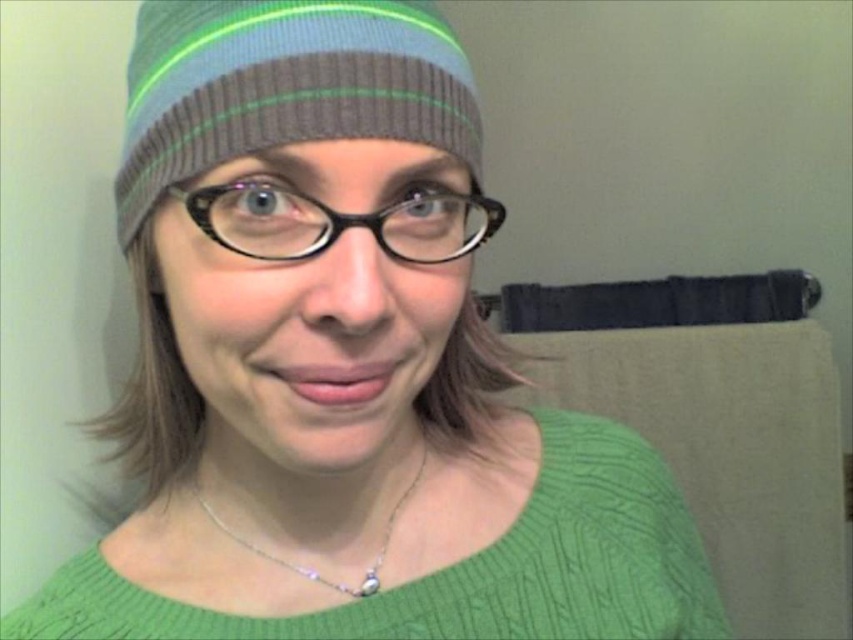
You are taking a photo of two points in the scene. The first point is at coordinates point (325, 122) and the second is at point (378, 573). Which point is closer to the camera?

Point (325, 122) is closer to the camera than point (378, 573).